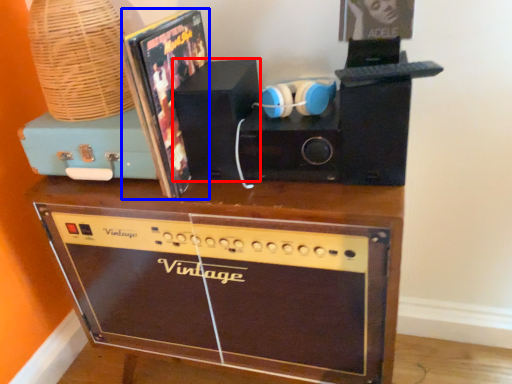
Question: Which of the following is the closest to the observer, speaker (highlighted by a red box) or album cover (highlighted by a blue box)?

Choices:
 (A) speaker
 (B) album cover

Answer: (B)